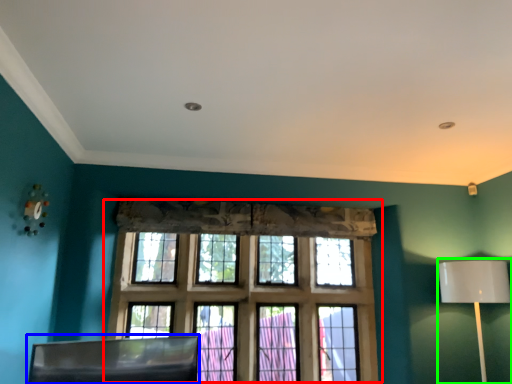
Question: Based on their relative distances, which object is farther from window (highlighted by a red box)? Choose from swivel chair (highlighted by a blue box) and table lamp (highlighted by a green box).

Choices:
 (A) swivel chair
 (B) table lamp

Answer: (B)